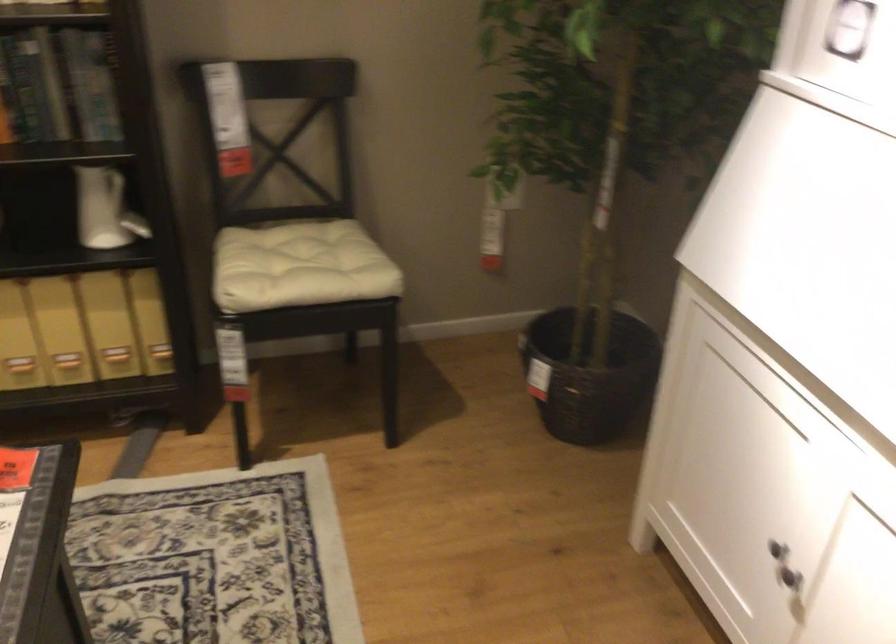
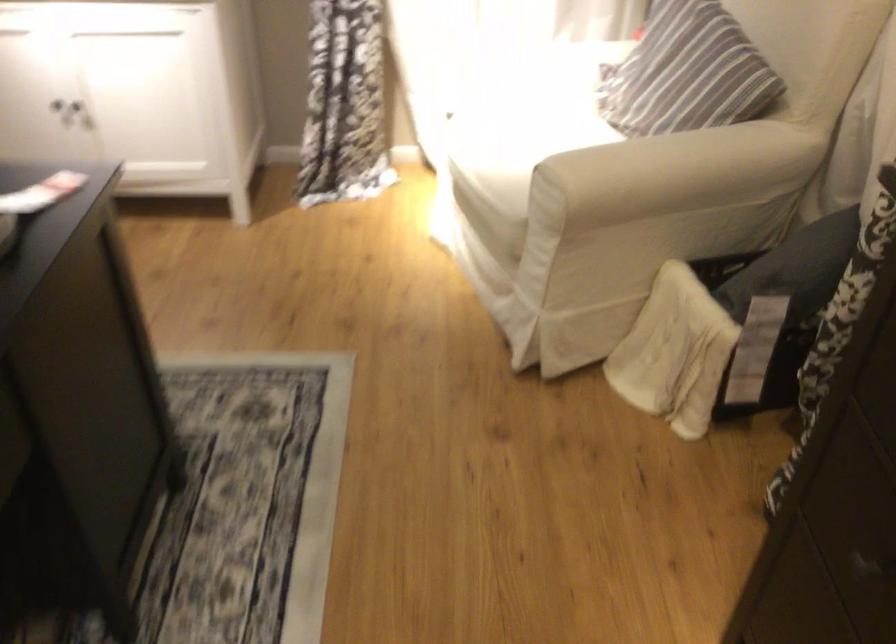
Find the pixel in the second image that matches (772,522) in the first image.

(52, 99)